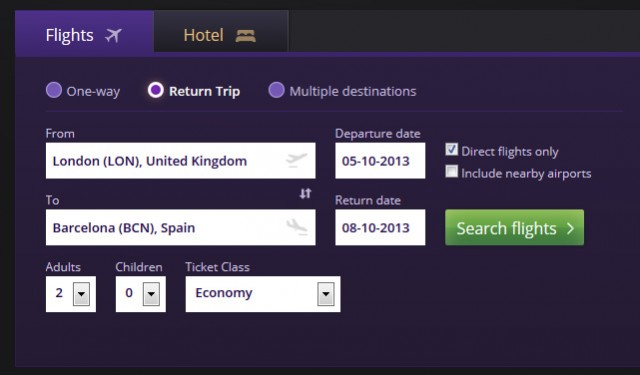
Identify the location of bed image. (244, 35).